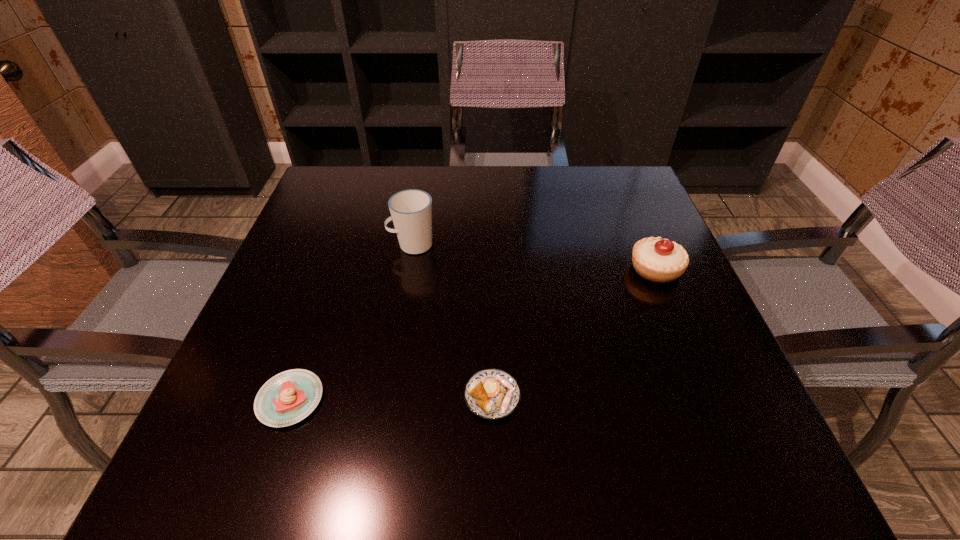
Where is `free space between the leftmost pastry and the rightmost pastry`? The height and width of the screenshot is (540, 960). free space between the leftmost pastry and the rightmost pastry is located at coordinates (473, 334).

Where is `free space that is in between the cup and the tallest pastry`? The height and width of the screenshot is (540, 960). free space that is in between the cup and the tallest pastry is located at coordinates (534, 257).

Find the location of a particular element. empty space between the third shortest object and the leftmost pastry is located at coordinates (473, 334).

Image resolution: width=960 pixels, height=540 pixels. I want to click on free space between the second pastry from right to left and the tallest pastry, so click(x=574, y=333).

Locate an element on the screen. The width and height of the screenshot is (960, 540). unoccupied area between the leftmost object and the rightmost pastry is located at coordinates (473, 334).

Locate an element on the screen. The width and height of the screenshot is (960, 540). vacant area that lies between the leftmost object and the third object from right to left is located at coordinates (351, 322).

Find the location of a particular element. This screenshot has width=960, height=540. free space between the leftmost pastry and the second pastry from left to right is located at coordinates [392, 398].

Image resolution: width=960 pixels, height=540 pixels. I want to click on vacant area that lies between the tallest object and the third object from left to right, so click(x=452, y=321).

This screenshot has width=960, height=540. What are the coordinates of `empty space that is in between the leftmost object and the farthest pastry` in the screenshot? It's located at (473, 334).

You are a GUI agent. You are given a task and a screenshot of the screen. Output one action in this format:
    pyautogui.click(x=<x>, y=<y>)
    Task: Click on the free area in between the tallest pastry and the second object from right to left
    This screenshot has height=540, width=960.
    Given the screenshot: What is the action you would take?
    pyautogui.click(x=574, y=333)